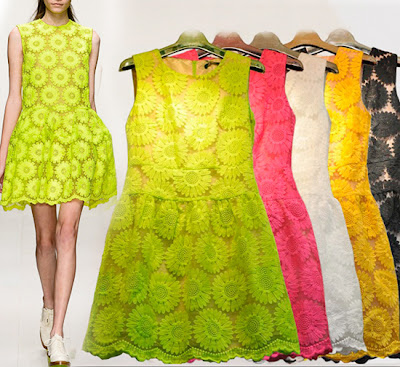
Identify the location of hangers. The image size is (400, 367). (199, 37), (226, 38), (270, 45), (308, 37), (346, 39).